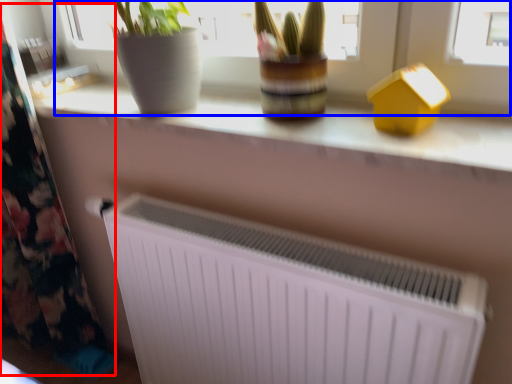
Question: Which of the following is the closest to the observer, curtain (highlighted by a red box) or bay window (highlighted by a blue box)?

Choices:
 (A) curtain
 (B) bay window

Answer: (B)